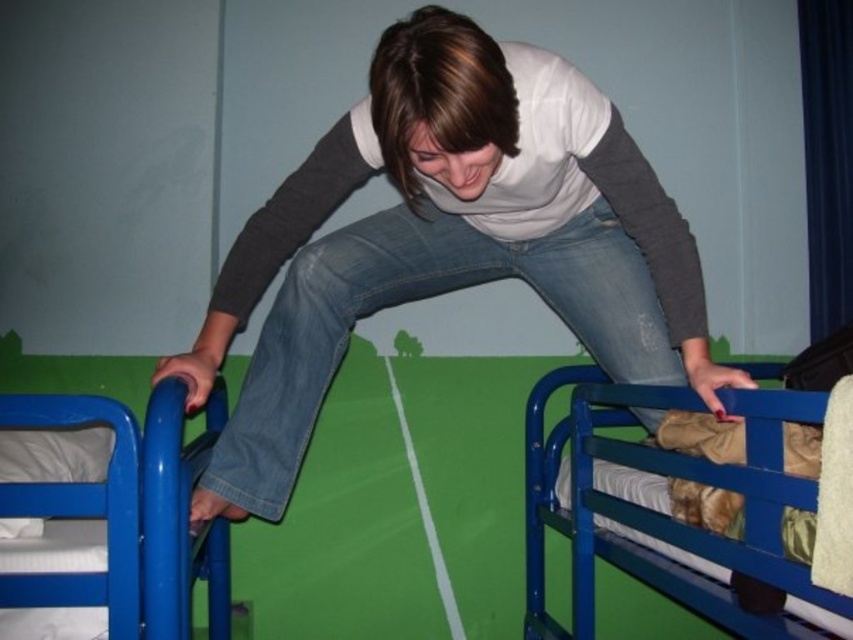
Question: Among these objects, which one is farthest from the camera?

Choices:
 (A) jeans at center
 (B) blue metal bunk bed at upper right
 (C) blue metallic bunk bed at left

Answer: (A)

Question: Can you confirm if blue metal bunk bed at upper right is thinner than blue metallic bunk bed at left?

Choices:
 (A) yes
 (B) no

Answer: (A)

Question: Can you confirm if jeans at center is positioned above blue metallic bunk bed at left?

Choices:
 (A) yes
 (B) no

Answer: (A)

Question: Which of these objects is positioned farthest from the jeans at center?

Choices:
 (A) blue metal bunk bed at upper right
 (B) blue metallic bunk bed at left

Answer: (B)

Question: Does blue metal bunk bed at upper right appear over blue metallic bunk bed at left?

Choices:
 (A) no
 (B) yes

Answer: (A)

Question: Which object is farther from the camera taking this photo?

Choices:
 (A) blue metallic bunk bed at left
 (B) blue metal bunk bed at upper right
 (C) jeans at center

Answer: (C)